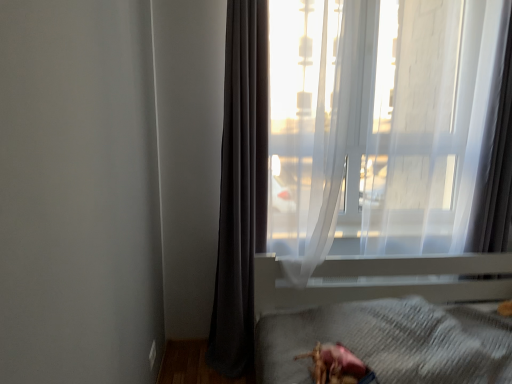
Question: Does shiny pink toy at lower center have a greater height compared to white plastic bed frame at lower right?

Choices:
 (A) no
 (B) yes

Answer: (A)

Question: From the image's perspective, would you say shiny pink toy at lower center is positioned over white plastic bed frame at lower right?

Choices:
 (A) yes
 (B) no

Answer: (A)

Question: From the image's perspective, is shiny pink toy at lower center located beneath white plastic bed frame at lower right?

Choices:
 (A) no
 (B) yes

Answer: (A)

Question: Considering the relative sizes of shiny pink toy at lower center and white plastic bed frame at lower right in the image provided, is shiny pink toy at lower center shorter than white plastic bed frame at lower right?

Choices:
 (A) yes
 (B) no

Answer: (A)

Question: Are shiny pink toy at lower center and white plastic bed frame at lower right far apart?

Choices:
 (A) yes
 (B) no

Answer: (B)

Question: Relative to shiny pink toy at lower center, is transparent fabric at upper right in front or behind?

Choices:
 (A) behind
 (B) front

Answer: (A)

Question: From the image's perspective, is transparent fabric at upper right positioned above or below shiny pink toy at lower center?

Choices:
 (A) below
 (B) above

Answer: (B)

Question: Does point (283, 168) appear closer or farther from the camera than point (359, 360)?

Choices:
 (A) farther
 (B) closer

Answer: (A)

Question: Is transparent fabric at upper right spatially inside shiny pink toy at lower center, or outside of it?

Choices:
 (A) inside
 (B) outside

Answer: (B)

Question: In the image, is dark gray fabric curtain at left positioned in front of or behind white plastic bed frame at lower right?

Choices:
 (A) front
 (B) behind

Answer: (B)

Question: From a real-world perspective, is dark gray fabric curtain at left above or below white plastic bed frame at lower right?

Choices:
 (A) above
 (B) below

Answer: (A)

Question: From the image's perspective, is dark gray fabric curtain at left positioned above or below white plastic bed frame at lower right?

Choices:
 (A) below
 (B) above

Answer: (B)

Question: Does point (228, 238) appear closer or farther from the camera than point (262, 269)?

Choices:
 (A) farther
 (B) closer

Answer: (A)

Question: From the image's perspective, is white plastic bed frame at lower right above or below transparent fabric at upper right?

Choices:
 (A) above
 (B) below

Answer: (B)

Question: Visually, is white plastic bed frame at lower right positioned to the left or to the right of transparent fabric at upper right?

Choices:
 (A) left
 (B) right

Answer: (B)